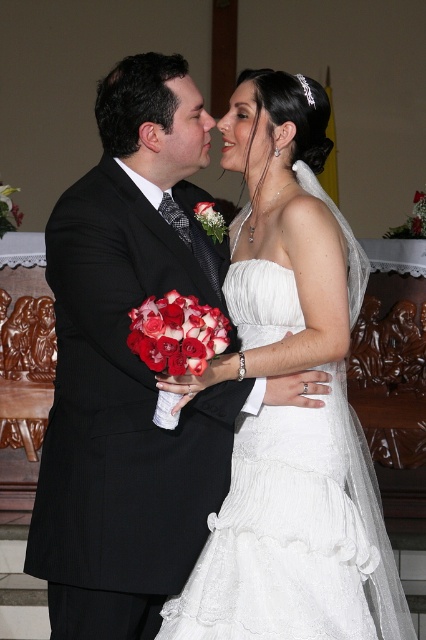
You are a photographer positioned at the entrance of the venue. You need to capture a closeup shot of the white satin dress at center. Based on the coordinates provided, in which direction should you move to get closer to the dress?

The white satin dress at center is located at point (290,410). Since the photographer is at the entrance, moving towards the center of the venue would bring them closer to the dress.

You are a photographer positioned at point (290, 410). You need to capture a closeup shot of the white satin dress at center. Is your current position suitable for this?

Yes, because the white satin dress at center is located exactly at your current position at point (290, 410).

You are a photographer at the wedding and want to capture a closeup shot of the red matte rose at center and the matte black forehead at upper center. Which one would you need to zoom in more on to get a detailed shot?

The red matte rose at center is larger in size compared to the matte black forehead at upper center, so you would need to zoom in less on the red matte rose at center and more on the matte black forehead at upper center to capture details.